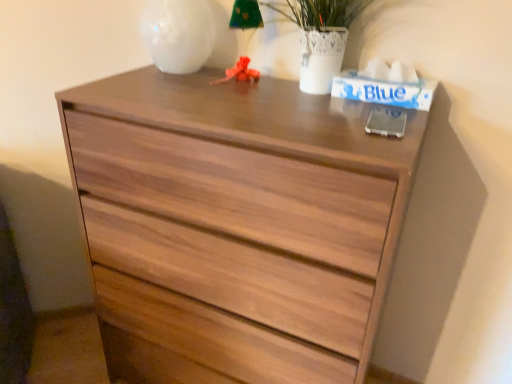
Question: Is matte white glass at upper center at the back of wooden chest of drawers at center?

Choices:
 (A) no
 (B) yes

Answer: (A)

Question: Would you consider wooden chest of drawers at center to be distant from matte white glass at upper center?

Choices:
 (A) yes
 (B) no

Answer: (B)

Question: Considering the relative sizes of wooden chest of drawers at center and matte white glass at upper center in the image provided, is wooden chest of drawers at center bigger than matte white glass at upper center?

Choices:
 (A) yes
 (B) no

Answer: (A)

Question: Is wooden chest of drawers at center facing towards matte white glass at upper center?

Choices:
 (A) yes
 (B) no

Answer: (B)

Question: From a real-world perspective, is wooden chest of drawers at center under matte white glass at upper center?

Choices:
 (A) yes
 (B) no

Answer: (A)

Question: Does wooden chest of drawers at center have a lesser height compared to matte white glass at upper center?

Choices:
 (A) no
 (B) yes

Answer: (A)

Question: Can you confirm if matte white glass at upper center is positioned to the left of wooden chest of drawers at center?

Choices:
 (A) no
 (B) yes

Answer: (B)

Question: Can you see matte white glass at upper center touching wooden chest of drawers at center?

Choices:
 (A) no
 (B) yes

Answer: (A)

Question: From a real-world perspective, is matte white glass at upper center physically above wooden chest of drawers at center?

Choices:
 (A) no
 (B) yes

Answer: (B)

Question: Does matte white glass at upper center have a lesser width compared to wooden chest of drawers at center?

Choices:
 (A) no
 (B) yes

Answer: (B)

Question: Is matte white glass at upper center far from wooden chest of drawers at center?

Choices:
 (A) yes
 (B) no

Answer: (B)

Question: Does matte white glass at upper center have a lesser height compared to wooden chest of drawers at center?

Choices:
 (A) yes
 (B) no

Answer: (A)

Question: Looking at the image, does matte white glass at upper center seem bigger or smaller compared to wooden chest of drawers at center?

Choices:
 (A) big
 (B) small

Answer: (B)